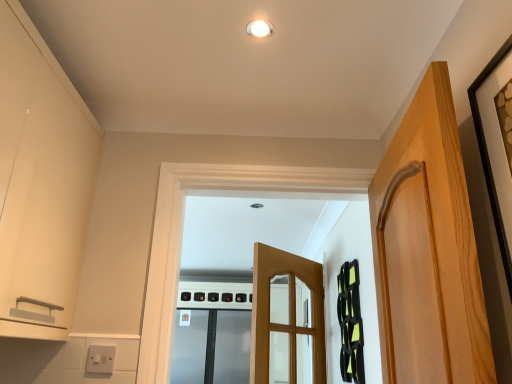
The image size is (512, 384). Identify the location of vacant space situated on the left part of white glossy light fixture at upper center. (212, 29).